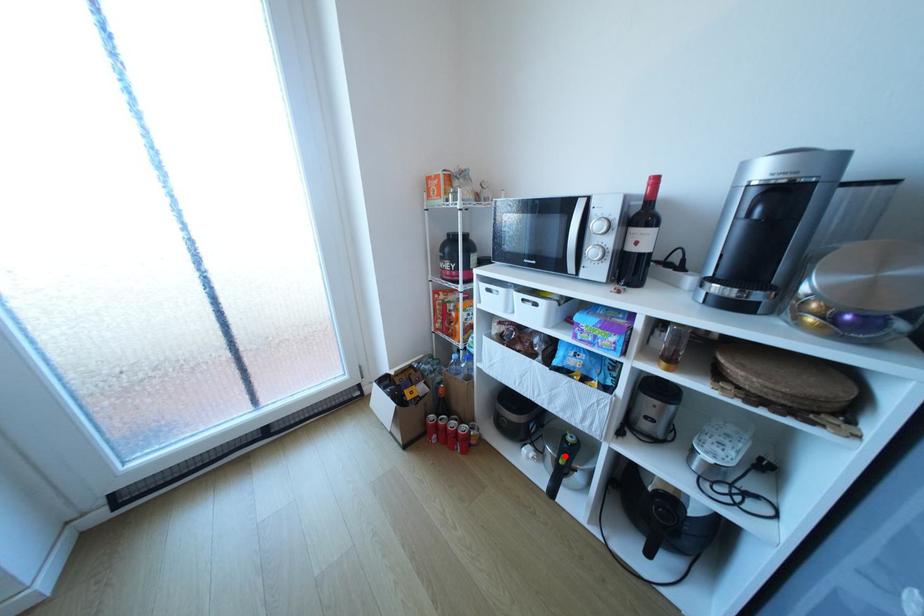
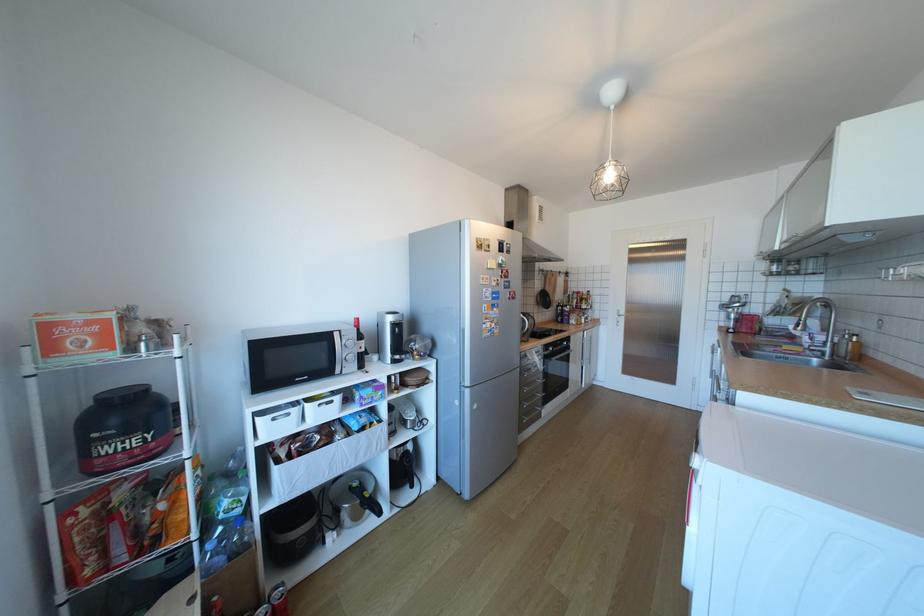
Question: A red point is marked in image1. In image2, is the corresponding 3D point closer to the camera or farther? Reply with the corresponding letter.

Choices:
 (A) The corresponding 3D point is closer.
 (B) The corresponding 3D point is farther.

Answer: (B)